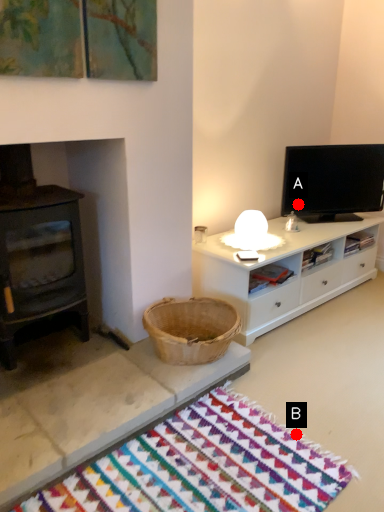
Question: Two points are circled on the image, labeled by A and B beside each circle. Which point is further to the camera?

Choices:
 (A) A is further
 (B) B is further

Answer: (A)